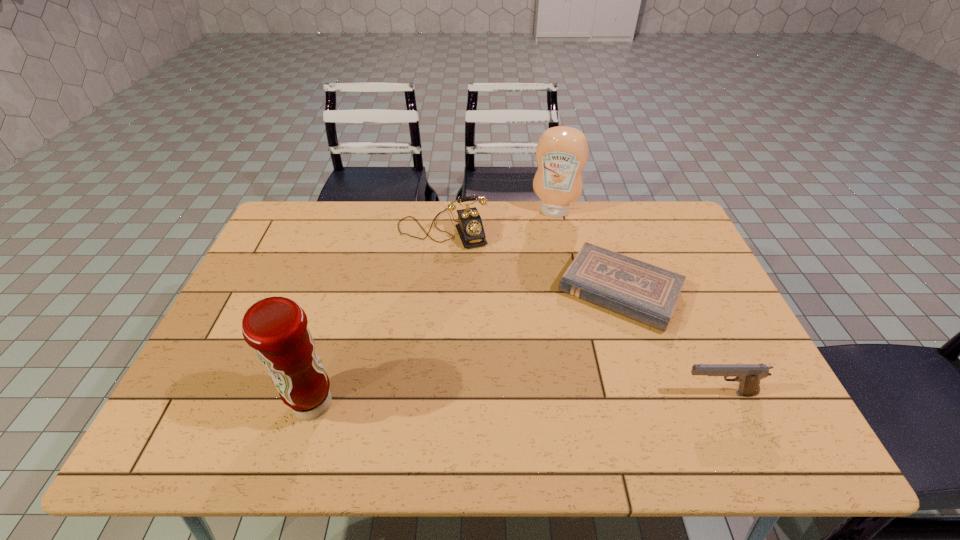
I want to click on vacant area in the image that satisfies the following two spatial constraints: 1. on the back side of the leftmost object; 2. on the right side of the right condiment, so click(x=371, y=211).